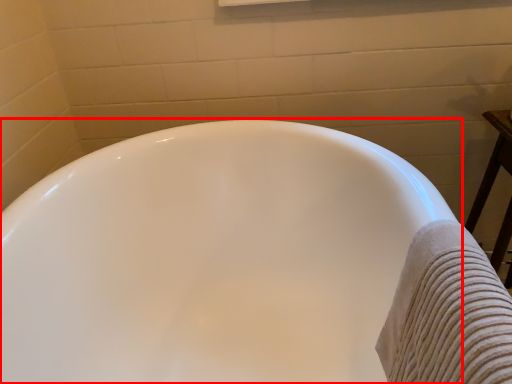
Question: Observing the image, what is the correct spatial positioning of bathtub (annotated by the red box) in reference to bath towel?

Choices:
 (A) left
 (B) right

Answer: (A)